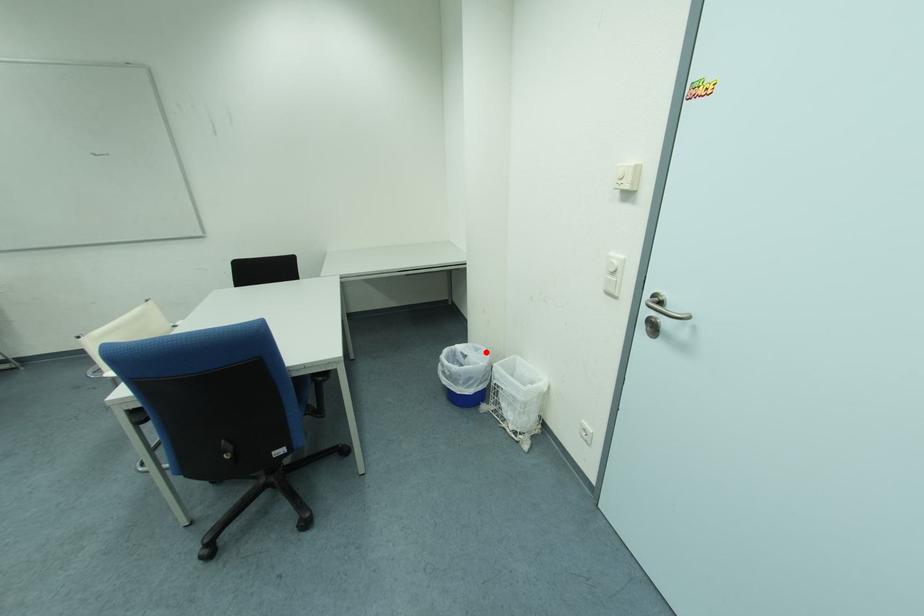
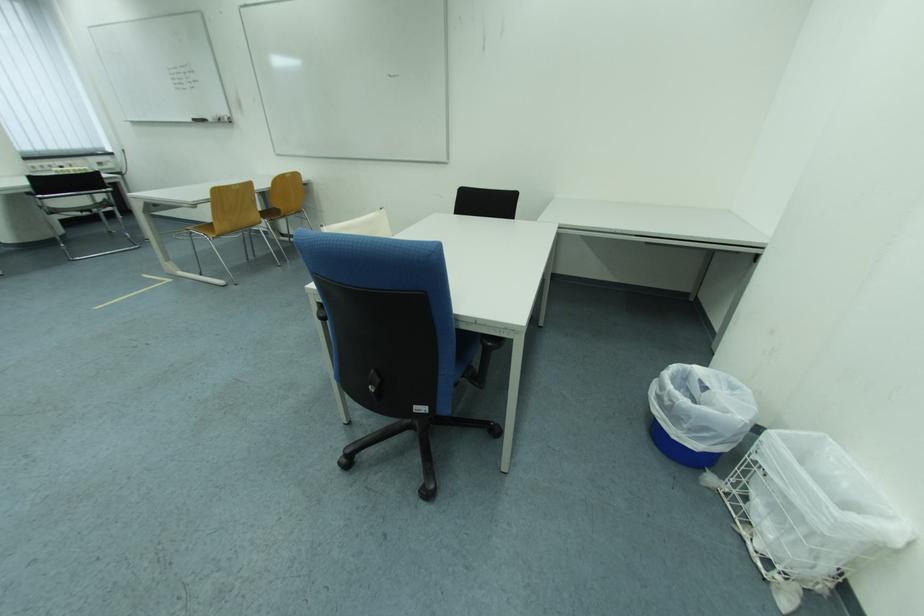
Where in the second image is the point corresponding to the highlighted location from the first image?

(742, 390)